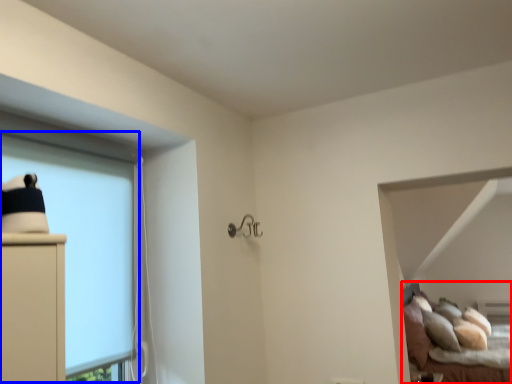
Question: Which object appears closest to the camera in this image, bed (highlighted by a red box) or bay window (highlighted by a blue box)?

Choices:
 (A) bed
 (B) bay window

Answer: (B)